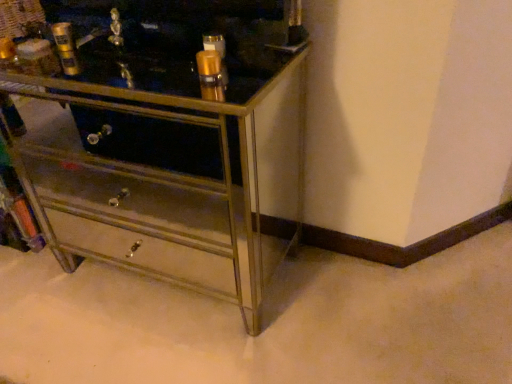
Locate an element on the screen. This screenshot has width=512, height=384. metallic mirrored chest of drawers at center is located at coordinates (170, 123).

Describe the element at coordinates (170, 123) in the screenshot. The height and width of the screenshot is (384, 512). I see `metallic mirrored chest of drawers at center` at that location.

What is the approximate height of metallic mirrored chest of drawers at center?

metallic mirrored chest of drawers at center is 31.36 inches in height.

In order to face metallic mirrored chest of drawers at center, should I rotate leftwards or rightwards?

Turn left by 12.037 degrees to look at metallic mirrored chest of drawers at center.

Locate an element on the screen. metallic mirrored chest of drawers at center is located at coordinates coord(170,123).